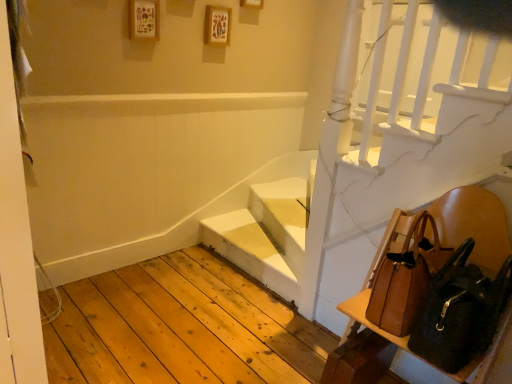
This screenshot has width=512, height=384. Describe the element at coordinates (460, 311) in the screenshot. I see `brown leather shoulder bag at lower right, acting as the 2th shoulder bag starting from the back` at that location.

Identify the location of brown leather chair at lower right. Image resolution: width=512 pixels, height=384 pixels. (366, 326).

What do you see at coordinates (404, 272) in the screenshot? I see `brown leather shoulder bag at right, placed as the second shoulder bag when sorted from front to back` at bounding box center [404, 272].

The height and width of the screenshot is (384, 512). I want to click on brown leather shoulder bag at right, placed as the second shoulder bag when sorted from front to back, so click(404, 272).

Locate an element on the screen. brown leather shoulder bag at lower right, acting as the 2th shoulder bag starting from the back is located at coordinates (460, 311).

Is brown leather chair at lower right aimed at brown leather shoulder bag at lower right, the first shoulder bag viewed from the front?

Yes, brown leather chair at lower right is aimed at brown leather shoulder bag at lower right, the first shoulder bag viewed from the front.

How distant is brown leather chair at lower right from brown leather shoulder bag at lower right, acting as the 2th shoulder bag starting from the back?

brown leather chair at lower right and brown leather shoulder bag at lower right, acting as the 2th shoulder bag starting from the back, are 12.78 centimeters apart from each other.

Is brown leather chair at lower right far away from brown leather shoulder bag at lower right, acting as the 2th shoulder bag starting from the back?

Actually, brown leather chair at lower right and brown leather shoulder bag at lower right, acting as the 2th shoulder bag starting from the back, are a little close together.

Based on the photo, is brown leather chair at lower right completely or partially outside of brown leather shoulder bag at lower right, acting as the 2th shoulder bag starting from the back?

Yes, brown leather chair at lower right is outside of brown leather shoulder bag at lower right, acting as the 2th shoulder bag starting from the back.

In the image, is white matte stairs at center positioned in front of or behind brown leather shoulder bag at right, placed as the second shoulder bag when sorted from front to back?

In the image, white matte stairs at center appears behind brown leather shoulder bag at right, placed as the second shoulder bag when sorted from front to back.

From the image's perspective, which one is positioned higher, white matte stairs at center or brown leather shoulder bag at right, placed as the second shoulder bag when sorted from front to back?

brown leather shoulder bag at right, placed as the second shoulder bag when sorted from front to back.

Identify the location of stairwell lying on the left of brown leather shoulder bag at right, placed as the second shoulder bag when sorted from front to back. (268, 226).

Considering the sizes of objects brown leather shoulder bag at lower right, acting as the 2th shoulder bag starting from the back, and white matte stairs at center in the image provided, who is shorter, brown leather shoulder bag at lower right, acting as the 2th shoulder bag starting from the back, or white matte stairs at center?

white matte stairs at center.

Is brown leather shoulder bag at lower right, the first shoulder bag viewed from the front, smaller than white matte stairs at center?

Indeed, brown leather shoulder bag at lower right, the first shoulder bag viewed from the front, has a smaller size compared to white matte stairs at center.

From the picture: Between brown leather shoulder bag at lower right, acting as the 2th shoulder bag starting from the back, and white matte stairs at center, which one appears on the left side from the viewer's perspective?

white matte stairs at center.

From the image's perspective, would you say brown leather shoulder bag at lower right, acting as the 2th shoulder bag starting from the back, is shown under white matte stairs at center?

Actually, brown leather shoulder bag at lower right, acting as the 2th shoulder bag starting from the back, appears above white matte stairs at center in the image.

Consider the image. From the image's perspective, which is below, brown leather shoulder bag at right, placed as the second shoulder bag when sorted from front to back, or brown leather shoulder bag at lower right, acting as the 2th shoulder bag starting from the back?

brown leather shoulder bag at lower right, acting as the 2th shoulder bag starting from the back.

Which of these two, brown leather shoulder bag at right, placed as the second shoulder bag when sorted from front to back, or brown leather shoulder bag at lower right, acting as the 2th shoulder bag starting from the back, is wider?

brown leather shoulder bag at lower right, acting as the 2th shoulder bag starting from the back, is wider.

From a real-world perspective, which object rests below the other?

From a 3D spatial view, brown leather shoulder bag at right, placed as the second shoulder bag when sorted from front to back, is below.

Which point is more distant from viewer, (x=399, y=252) or (x=494, y=291)?

The point (x=399, y=252) is behind.

Is brown leather shoulder bag at right, placed as the second shoulder bag when sorted from front to back, bigger than white matte stairs at center?

No, brown leather shoulder bag at right, placed as the second shoulder bag when sorted from front to back, is not bigger than white matte stairs at center.

Based on the photo, is white matte stairs at center at the back of brown leather shoulder bag at right, which ranks as the 1th shoulder bag in back-to-front order?

No, brown leather shoulder bag at right, which ranks as the 1th shoulder bag in back-to-front order, is not facing the opposite direction of white matte stairs at center.

Does point (401, 254) come closer to viewer compared to point (306, 185)?

Yes, point (401, 254) is in front of point (306, 185).

From the picture: Which is farther from the camera, (252, 191) or (493, 289)?

Answer: The point (252, 191) is farther.

Is brown leather shoulder bag at lower right, acting as the 2th shoulder bag starting from the back, completely or partially inside white matte stairs at center?

No, white matte stairs at center does not contain brown leather shoulder bag at lower right, acting as the 2th shoulder bag starting from the back.

Can you confirm if white matte stairs at center is wider than brown leather shoulder bag at lower right, the first shoulder bag viewed from the front?

Yes, white matte stairs at center is wider than brown leather shoulder bag at lower right, the first shoulder bag viewed from the front.

Considering the sizes of objects white matte stairs at center and brown leather shoulder bag at lower right, the first shoulder bag viewed from the front, in the image provided, who is shorter, white matte stairs at center or brown leather shoulder bag at lower right, the first shoulder bag viewed from the front,?

white matte stairs at center is shorter.

Does brown leather shoulder bag at right, which ranks as the 1th shoulder bag in back-to-front order, lie behind brown leather chair at lower right?

Yes, the depth of brown leather shoulder bag at right, which ranks as the 1th shoulder bag in back-to-front order, is greater than that of brown leather chair at lower right.

Is brown leather shoulder bag at right, which ranks as the 1th shoulder bag in back-to-front order, not within brown leather chair at lower right?

That's incorrect, brown leather shoulder bag at right, which ranks as the 1th shoulder bag in back-to-front order, is not completely outside brown leather chair at lower right.

How much distance is there between brown leather shoulder bag at right, which ranks as the 1th shoulder bag in back-to-front order, and brown leather chair at lower right?

The distance of brown leather shoulder bag at right, which ranks as the 1th shoulder bag in back-to-front order, from brown leather chair at lower right is 8.21 centimeters.

From a real-world perspective, is brown leather shoulder bag at right, which ranks as the 1th shoulder bag in back-to-front order, positioned above or below brown leather chair at lower right?

brown leather shoulder bag at right, which ranks as the 1th shoulder bag in back-to-front order, is situated higher than brown leather chair at lower right in the real world.

The width and height of the screenshot is (512, 384). Find the location of `furniture below the brown leather shoulder bag at lower right, acting as the 2th shoulder bag starting from the back (from the image's perspective)`. furniture below the brown leather shoulder bag at lower right, acting as the 2th shoulder bag starting from the back (from the image's perspective) is located at coordinates (366, 326).

Find the location of a particular element. The width and height of the screenshot is (512, 384). shoulder bag that is the 2nd object located above the white matte stairs at center (from the image's perspective) is located at coordinates (404, 272).

Estimate the real-world distances between objects in this image. Which object is further from white matte stairs at center, brown leather shoulder bag at lower right, acting as the 2th shoulder bag starting from the back, or brown leather chair at lower right?

brown leather shoulder bag at lower right, acting as the 2th shoulder bag starting from the back, lies further to white matte stairs at center than the other object.

Estimate the real-world distances between objects in this image. Which object is closer to brown leather shoulder bag at lower right, acting as the 2th shoulder bag starting from the back, white matte stairs at center or brown leather shoulder bag at right, which ranks as the 1th shoulder bag in back-to-front order?

brown leather shoulder bag at right, which ranks as the 1th shoulder bag in back-to-front order, is positioned closer to the anchor brown leather shoulder bag at lower right, acting as the 2th shoulder bag starting from the back.

Based on their spatial positions, is brown leather shoulder bag at right, placed as the second shoulder bag when sorted from front to back, or brown leather shoulder bag at lower right, acting as the 2th shoulder bag starting from the back, further from white matte stairs at center?

brown leather shoulder bag at lower right, acting as the 2th shoulder bag starting from the back, is further to white matte stairs at center.

Which object lies further to the anchor point brown leather shoulder bag at right, placed as the second shoulder bag when sorted from front to back, white matte stairs at center or brown leather shoulder bag at lower right, the first shoulder bag viewed from the front?

Based on the image, white matte stairs at center appears to be further to brown leather shoulder bag at right, placed as the second shoulder bag when sorted from front to back.

When comparing their distances from brown leather shoulder bag at lower right, acting as the 2th shoulder bag starting from the back, does white matte stairs at center or brown leather chair at lower right seem further?

Among the two, white matte stairs at center is located further to brown leather shoulder bag at lower right, acting as the 2th shoulder bag starting from the back.

Which object lies further to the anchor point brown leather shoulder bag at right, which ranks as the 1th shoulder bag in back-to-front order, white matte stairs at center or brown leather chair at lower right?

white matte stairs at center lies further to brown leather shoulder bag at right, which ranks as the 1th shoulder bag in back-to-front order, than the other object.

Which object lies nearer to the anchor point brown leather shoulder bag at right, which ranks as the 1th shoulder bag in back-to-front order, brown leather chair at lower right or brown leather shoulder bag at lower right, the first shoulder bag viewed from the front?

brown leather chair at lower right is positioned closer to the anchor brown leather shoulder bag at right, which ranks as the 1th shoulder bag in back-to-front order.

Looking at the image, which one is located further to brown leather chair at lower right, white matte stairs at center or brown leather shoulder bag at lower right, acting as the 2th shoulder bag starting from the back?

Based on the image, white matte stairs at center appears to be further to brown leather chair at lower right.

Where is `shoulder bag between brown leather chair at lower right and brown leather shoulder bag at right, placed as the second shoulder bag when sorted from front to back, in the front-back direction`? shoulder bag between brown leather chair at lower right and brown leather shoulder bag at right, placed as the second shoulder bag when sorted from front to back, in the front-back direction is located at coordinates (460, 311).

This screenshot has width=512, height=384. I want to click on shoulder bag located between brown leather shoulder bag at lower right, the first shoulder bag viewed from the front, and white matte stairs at center in the depth direction, so click(x=404, y=272).